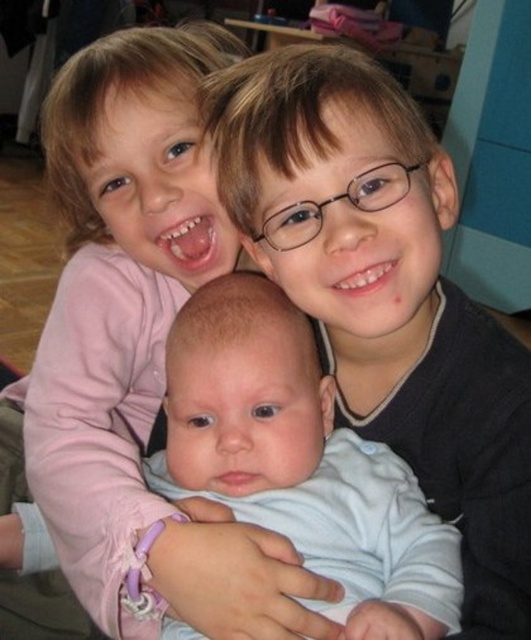
You are a photographer standing at the camera position. You want to take a closeup of the matte black sweater at center. Is the sweater within your reach if you can extend your arm 22 inches forward?

The distance between the matte black sweater at center and the camera is 21.82 inches, so yes, you can reach the sweater by extending your arm 22 inches forward.

You are a photographer trying to capture a closeup of the light blue fabric baby at center without the matte pink shirt at upper left blocking the view. Is this possible given their positions?

The light blue fabric baby at center is behind the matte pink shirt at upper left, so the matte pink shirt at upper left would block the view of the light blue fabric baby at center. Therefore, it is not possible to capture a closeup of the light blue fabric baby at center without the matte pink shirt at upper left blocking the view.

You are a photographer trying to capture a candid shot of the baby in the center. You notice two points marked in the image. The first point is at coordinate point(78, 67) and the second is at point(314, 499). Which point should you focus on to ensure the baby is in focus?

Point(78, 67) is behind point(314, 499). Therefore, to focus on the baby in the center, you should choose the point that is closer to the baby. Since the baby is in the center, the point closer to the center would be the better focus point. However, based on the coordinates provided, point(314, 499) is farther forward than point(78, 67). Wait, there might be confusion here. Let me recheck the description. The Objects Description says point(78, 67) is behind point(314, 499). That means the